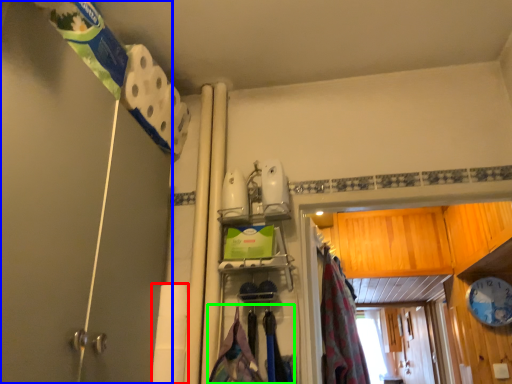
Question: Considering the real-world distances, which object is closest to toilet paper (highlighted by a red box)? shower door (highlighted by a blue box) or laundry (highlighted by a green box).

Choices:
 (A) shower door
 (B) laundry

Answer: (B)